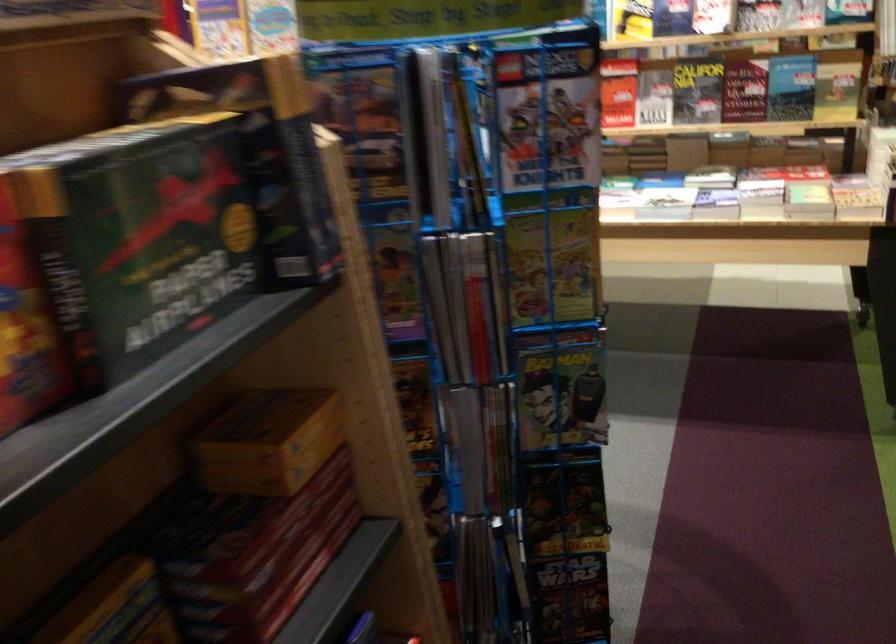
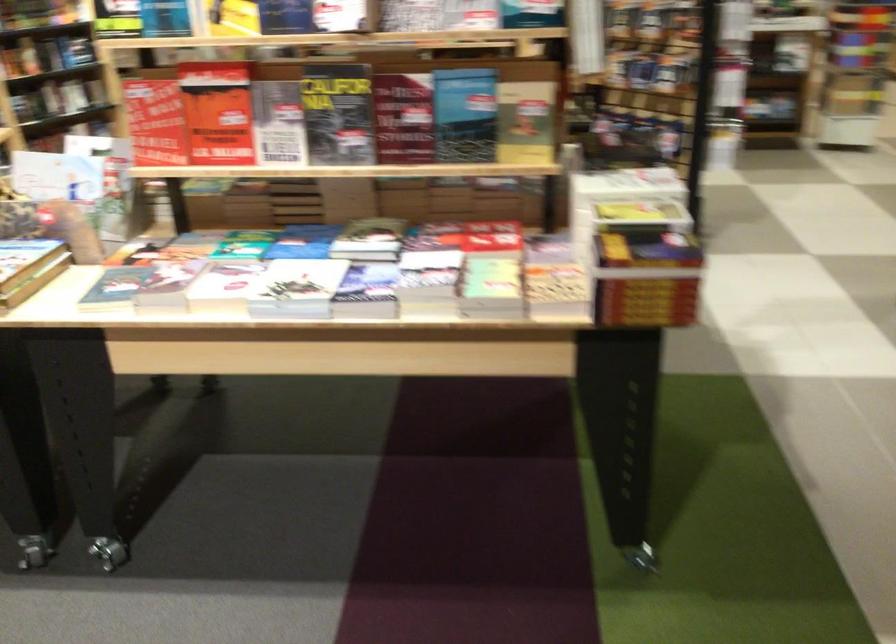
Question: The images are taken continuously from a first-person perspective. In which direction is your viewpoint rotating?

Choices:
 (A) Left
 (B) Right
 (C) Up
 (D) Down

Answer: (B)